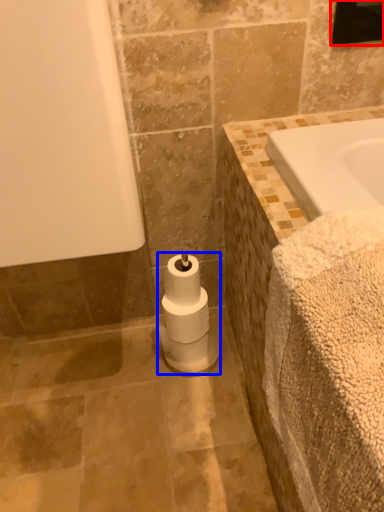
Question: Which object is closer to the camera taking this photo, mirror (highlighted by a red box) or toilet paper (highlighted by a blue box)?

Choices:
 (A) mirror
 (B) toilet paper

Answer: (A)